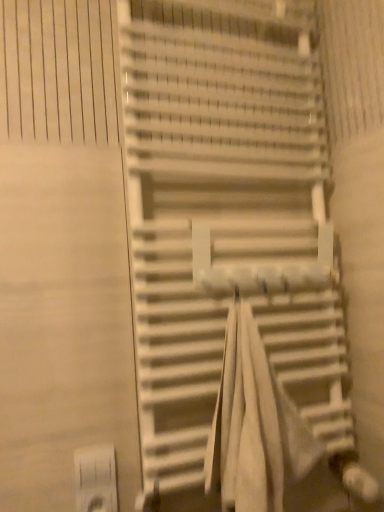
Question: Is white plastic electric outlet at lower left looking in the opposite direction of white fabric beach towel at center?

Choices:
 (A) no
 (B) yes

Answer: (A)

Question: Considering the relative positions of white plastic electric outlet at lower left and white fabric beach towel at center in the image provided, is white plastic electric outlet at lower left to the right of white fabric beach towel at center from the viewer's perspective?

Choices:
 (A) no
 (B) yes

Answer: (A)

Question: Is white plastic electric outlet at lower left outside white fabric beach towel at center?

Choices:
 (A) yes
 (B) no

Answer: (A)

Question: Does white plastic electric outlet at lower left have a greater width compared to white fabric beach towel at center?

Choices:
 (A) yes
 (B) no

Answer: (B)

Question: Does white plastic electric outlet at lower left have a greater height compared to white fabric beach towel at center?

Choices:
 (A) no
 (B) yes

Answer: (A)

Question: From a real-world perspective, is white matte stairs at center positioned above or below white fabric beach towel at center?

Choices:
 (A) below
 (B) above

Answer: (B)

Question: Considering the positions of point tap(284, 209) and point tap(249, 435), is point tap(284, 209) closer or farther from the camera than point tap(249, 435)?

Choices:
 (A) farther
 (B) closer

Answer: (A)

Question: Considering the positions of white matte stairs at center and white fabric beach towel at center in the image, is white matte stairs at center bigger or smaller than white fabric beach towel at center?

Choices:
 (A) small
 (B) big

Answer: (B)

Question: Considering their positions, is white matte stairs at center located in front of or behind white fabric beach towel at center?

Choices:
 (A) behind
 (B) front

Answer: (A)

Question: Considering their positions, is white fabric beach towel at center located in front of or behind white matte stairs at center?

Choices:
 (A) front
 (B) behind

Answer: (A)

Question: Does point (274, 388) appear closer or farther from the camera than point (236, 81)?

Choices:
 (A) closer
 (B) farther

Answer: (A)

Question: Is white fabric beach towel at center to the left or to the right of white matte stairs at center in the image?

Choices:
 (A) right
 (B) left

Answer: (A)

Question: Based on their sizes in the image, would you say white fabric beach towel at center is bigger or smaller than white matte stairs at center?

Choices:
 (A) big
 (B) small

Answer: (B)

Question: From a real-world perspective, is white matte stairs at center physically located above or below white plastic electric outlet at lower left?

Choices:
 (A) above
 (B) below

Answer: (A)

Question: From the image's perspective, is white matte stairs at center positioned above or below white plastic electric outlet at lower left?

Choices:
 (A) above
 (B) below

Answer: (A)